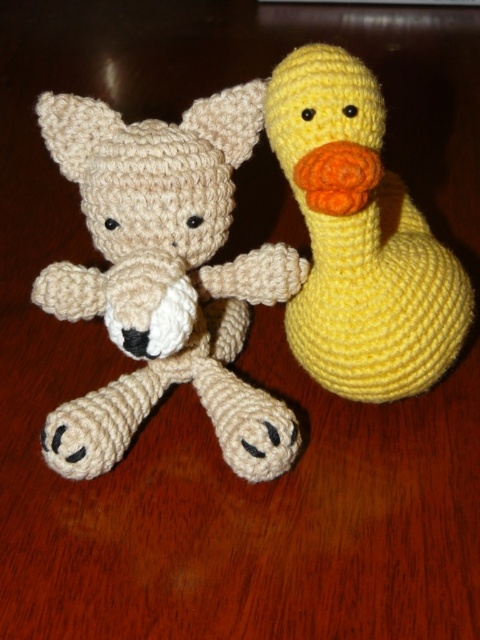
Can you confirm if beige yarn stuffed animal at left is positioned above yellow yarn duck at right?

Actually, beige yarn stuffed animal at left is below yellow yarn duck at right.

Locate an element on the screen. beige yarn stuffed animal at left is located at coordinates (165, 276).